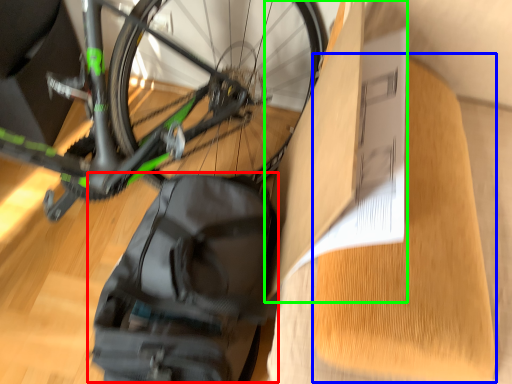
Question: Estimate the real-world distances between objects in this image. Which object is closer to backpack (highlighted by a red box), cardboard (highlighted by a blue box) or cardboard box (highlighted by a green box)?

Choices:
 (A) cardboard
 (B) cardboard box

Answer: (B)